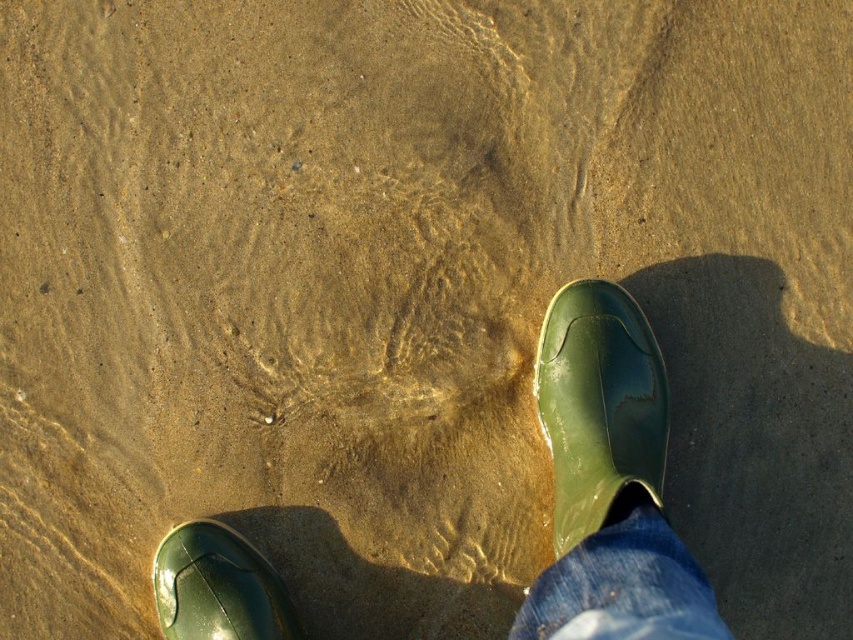
You are standing on the beach and see the denim at lower right and the green rubber boot at lower left. Which item is covering the other one?

The denim at lower right is positioned over the green rubber boot at lower left, so it is covering the boot.

You are standing on the beach and see the green rubber boots at center and the green rubber boot at lower left. Which one is larger in size?

The green rubber boots at center is bigger than the green rubber boot at lower left.